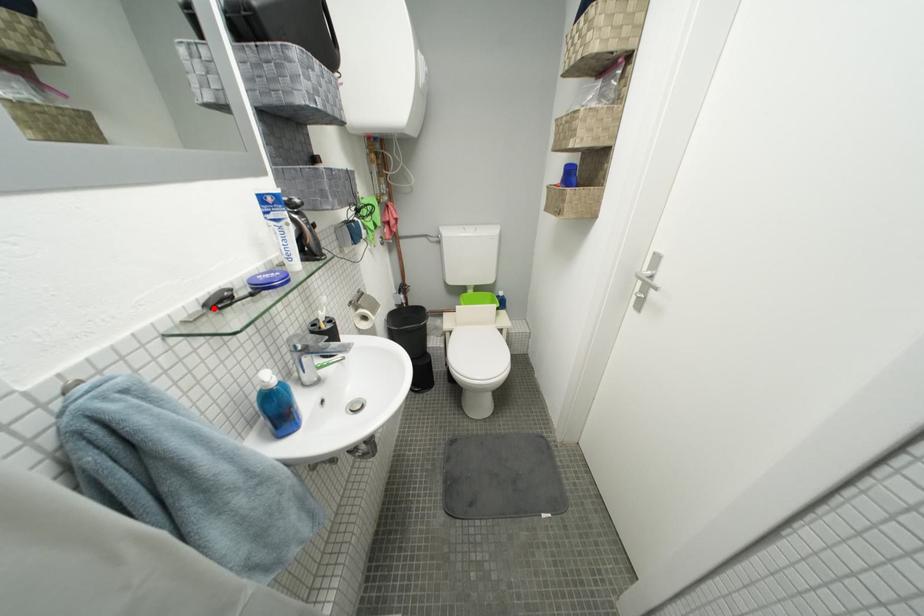
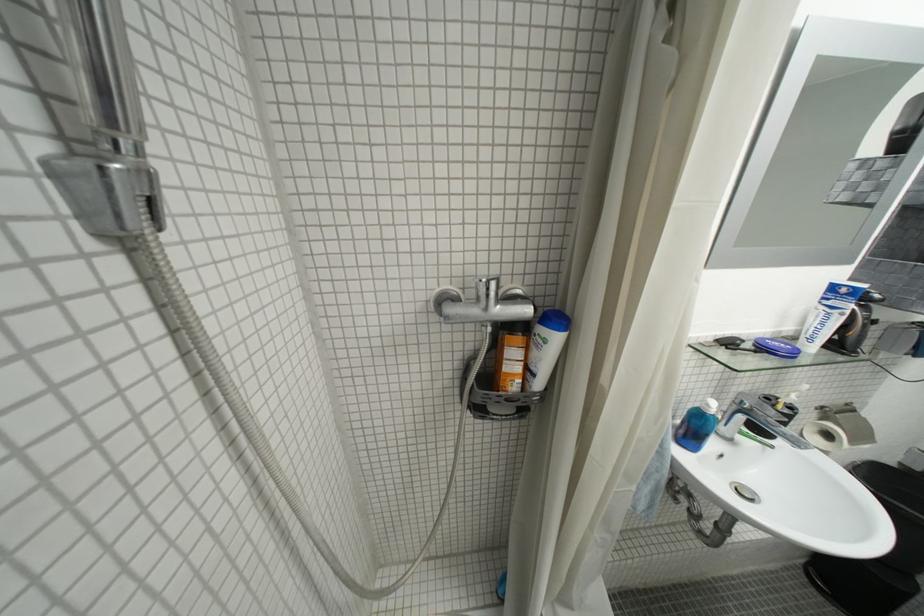
The point at the highlighted location is marked in the first image. Where is the corresponding point in the second image?

(725, 342)